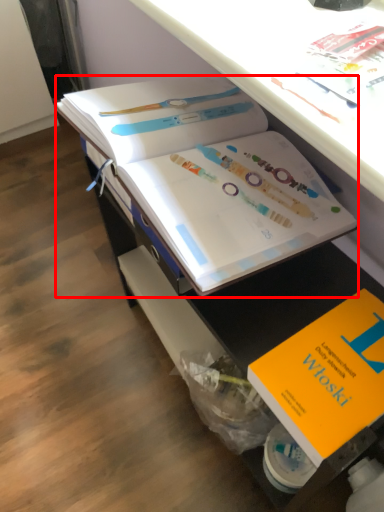
Question: From the image's perspective, where is book (annotated by the red box) located relative to book?

Choices:
 (A) below
 (B) above

Answer: (B)